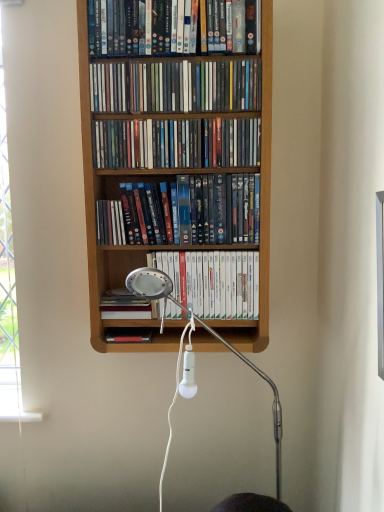
Question: Are wooden bookcase at center and hardcover book at center, the sixth book from the top, beside each other?

Choices:
 (A) yes
 (B) no

Answer: (B)

Question: From a real-world perspective, is wooden bookcase at center physically above hardcover book at center, which appears as the 1th book when ordered from the bottom?

Choices:
 (A) no
 (B) yes

Answer: (B)

Question: Is wooden bookcase at center positioned beyond the bounds of hardcover book at center, which appears as the 1th book when ordered from the bottom?

Choices:
 (A) no
 (B) yes

Answer: (B)

Question: Is wooden bookcase at center smaller than hardcover book at center, which appears as the 1th book when ordered from the bottom?

Choices:
 (A) yes
 (B) no

Answer: (B)

Question: Is the position of wooden bookcase at center more distant than that of hardcover book at center, which appears as the 1th book when ordered from the bottom?

Choices:
 (A) no
 (B) yes

Answer: (A)

Question: From a real-world perspective, is wooden bookcase at center positioned under hardcover book at center, the sixth book from the top, based on gravity?

Choices:
 (A) no
 (B) yes

Answer: (A)

Question: Is white matte book at center, the fifth book viewed from the top, far from wooden bookcase at center?

Choices:
 (A) yes
 (B) no

Answer: (B)

Question: From the image's perspective, is white matte book at center, acting as the second book starting from the bottom, beneath wooden bookcase at center?

Choices:
 (A) yes
 (B) no

Answer: (A)

Question: From a real-world perspective, does white matte book at center, acting as the second book starting from the bottom, sit lower than wooden bookcase at center?

Choices:
 (A) yes
 (B) no

Answer: (A)

Question: Does white matte book at center, the fifth book viewed from the top, have a larger size compared to wooden bookcase at center?

Choices:
 (A) no
 (B) yes

Answer: (A)

Question: Can you confirm if white matte book at center, the fifth book viewed from the top, is shorter than wooden bookcase at center?

Choices:
 (A) yes
 (B) no

Answer: (A)

Question: Is white matte book at center, the fifth book viewed from the top, turned away from wooden bookcase at center?

Choices:
 (A) no
 (B) yes

Answer: (B)

Question: Is the position of matte plastic dvds at upper center, which is the sixth book in bottom-to-top order, more distant than that of wooden shelf at upper center, placed as the second book when sorted from top to bottom?

Choices:
 (A) yes
 (B) no

Answer: (B)